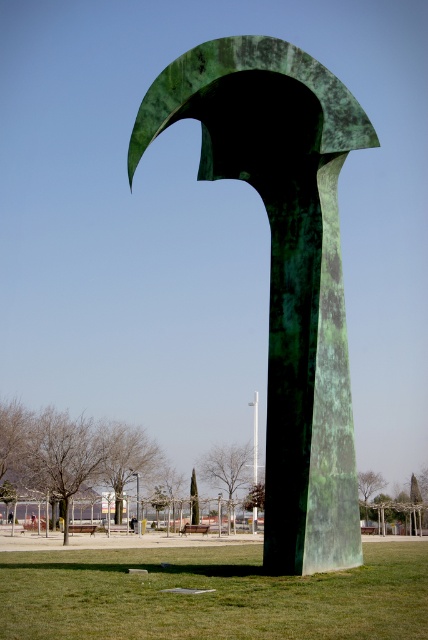
Which is above, green patinated metal arch at center or green grass at center?

green patinated metal arch at center is above.

Does point (217, 83) come closer to viewer compared to point (199, 596)?

No, (217, 83) is further to viewer.

Consider the image. Who is more distant from viewer, (348,417) or (169,620)?

Point (348,417)

Locate an element on the screen. The image size is (428, 640). green patinated metal arch at center is located at coordinates (285, 268).